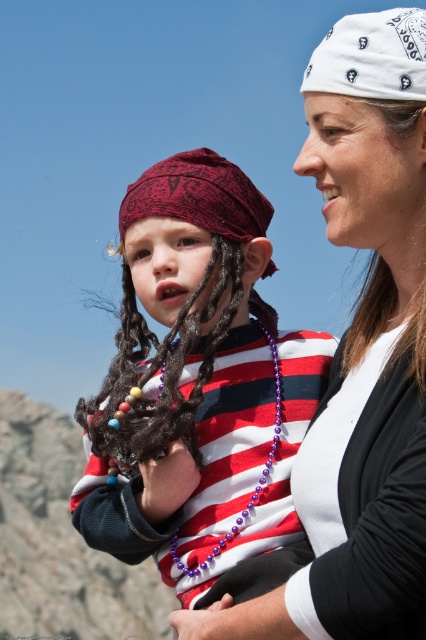
Question: Which object is the farthest from the purple beaded necklace at center?

Choices:
 (A) matte red bandana at center
 (B) white matte bandana at upper right

Answer: (B)

Question: Is white bandana at upper right positioned in front of purple beaded necklace at center?

Choices:
 (A) yes
 (B) no

Answer: (A)

Question: Can you confirm if matte red bandana at center is thinner than dark brown dreadlocks at center?

Choices:
 (A) no
 (B) yes

Answer: (A)

Question: Based on their relative distances, which object is nearer to the dark brown dreadlocks at center?

Choices:
 (A) matte red bandana at center
 (B) white matte bandana at upper right
 (C) purple beaded necklace at center

Answer: (A)

Question: Observing the image, what is the correct spatial positioning of matte red bandana at center in reference to dark brown dreadlocks at center?

Choices:
 (A) above
 (B) below

Answer: (B)

Question: Which object is farther from the camera taking this photo?

Choices:
 (A) white bandana at upper right
 (B) matte red bandana at center
 (C) dark brown dreadlocks at center

Answer: (C)